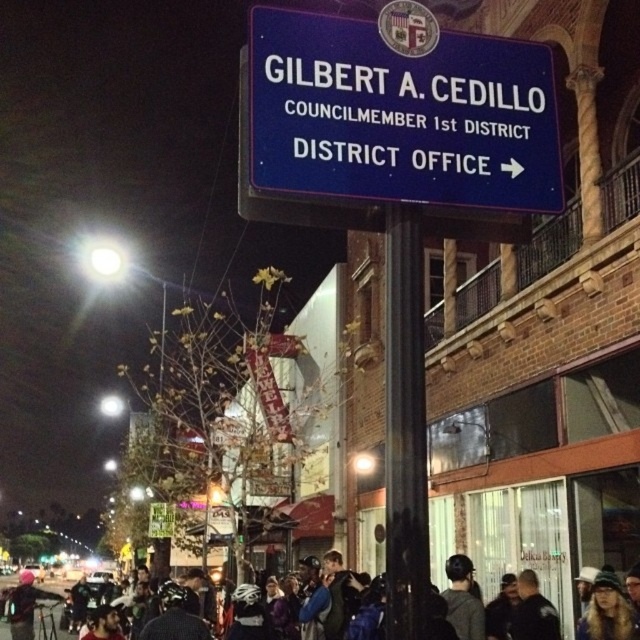
You are standing at the origin point of the image. Which direction should you move to reach the black glossy pole at center?

The black glossy pole at center is located at coordinates approximately 0.669 on the x axis and 0.633 on the y axis. Since you are at the origin, you should move towards the northeast direction to reach it.

You are standing at the base of the blue directional sign in the image. There is a point at coordinates [392,451] that you need to reach. If your maximum reach is 3.5 meters, can you touch that point without moving from your current position?

The distance of point [392,451] from viewer is 4.08 meters, so you cannot touch it since it is beyond your 3.5 meters reach.